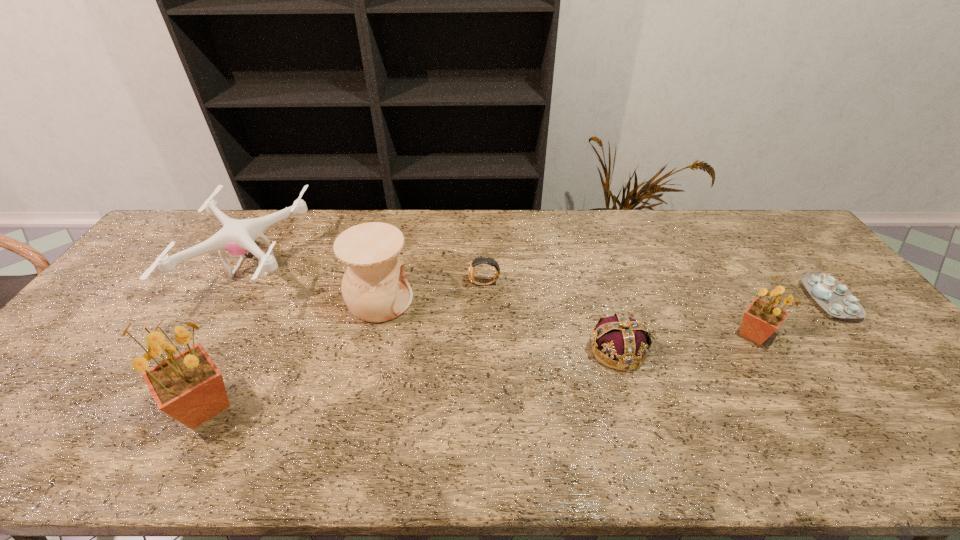
Please point a location where one more sunflower can be added evenly. Please provide its 2D coordinates. Your answer should be formatted as a tuple, i.e. [(x, y)], where the tuple contains the x and y coordinates of a point satisfying the conditions above.

[(499, 367)]